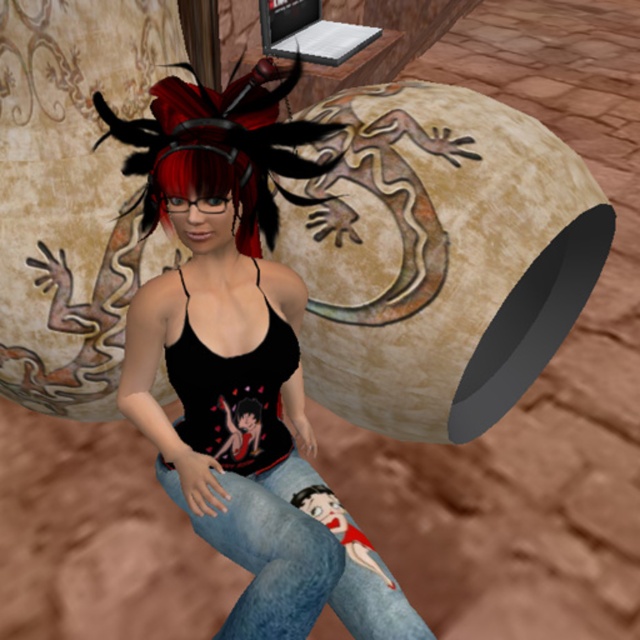
Is the position of matte black tank top at center less distant than that of denim jeans at center?

No, matte black tank top at center is behind denim jeans at center.

Is point (262, 282) closer to camera compared to point (236, 483)?

Yes, point (262, 282) is in front of point (236, 483).

Measure the distance between matte black tank top at center and camera.

matte black tank top at center and camera are 3.74 feet apart.

Locate an element on the screen. The width and height of the screenshot is (640, 640). matte black tank top at center is located at coordinates (241, 362).